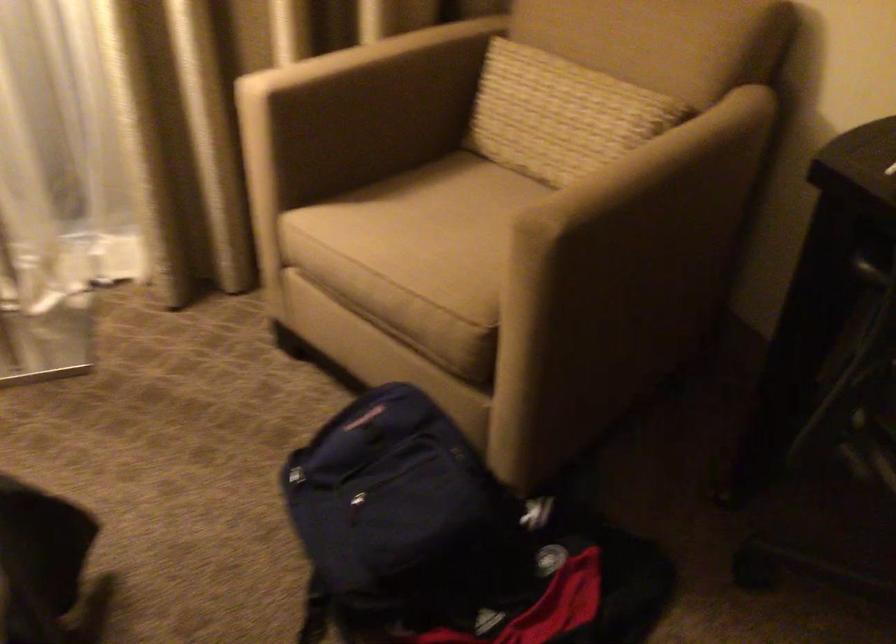
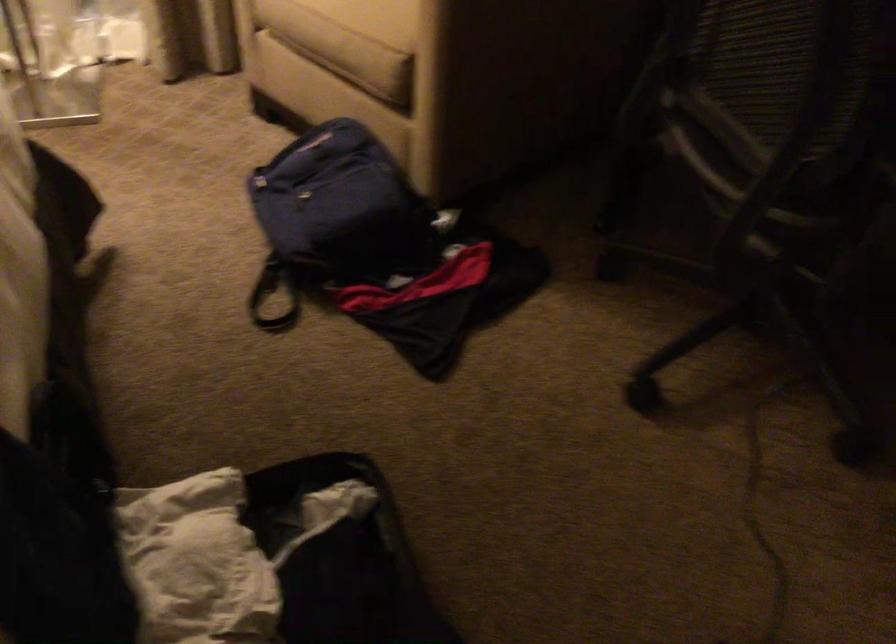
Find the pixel in the second image that matches (408,316) in the first image.

(347, 53)